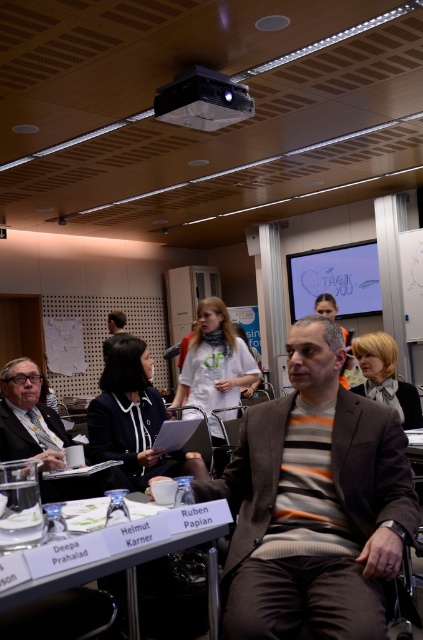
Question: Among these points, which one is farthest from the camera?

Choices:
 (A) (332, 296)
 (B) (173, 96)
 (C) (99, 566)

Answer: (A)

Question: Which point appears farthest from the camera in this image?

Choices:
 (A) (200, 100)
 (B) (112, 330)

Answer: (B)

Question: Does white plastic table at center appear under matte black jacket at center?

Choices:
 (A) no
 (B) yes

Answer: (B)

Question: Is striped wool sweater at center to the right of matte black jacket at center from the viewer's perspective?

Choices:
 (A) yes
 (B) no

Answer: (A)

Question: Is black plastic projector at upper center to the left of matte black jacket at center from the viewer's perspective?

Choices:
 (A) yes
 (B) no

Answer: (B)

Question: Which of these objects is positioned closest to the white plastic table at center?

Choices:
 (A) striped wool sweater at center
 (B) white shirt at center
 (C) matte black jacket at center
 (D) black plastic projector at upper center

Answer: (A)